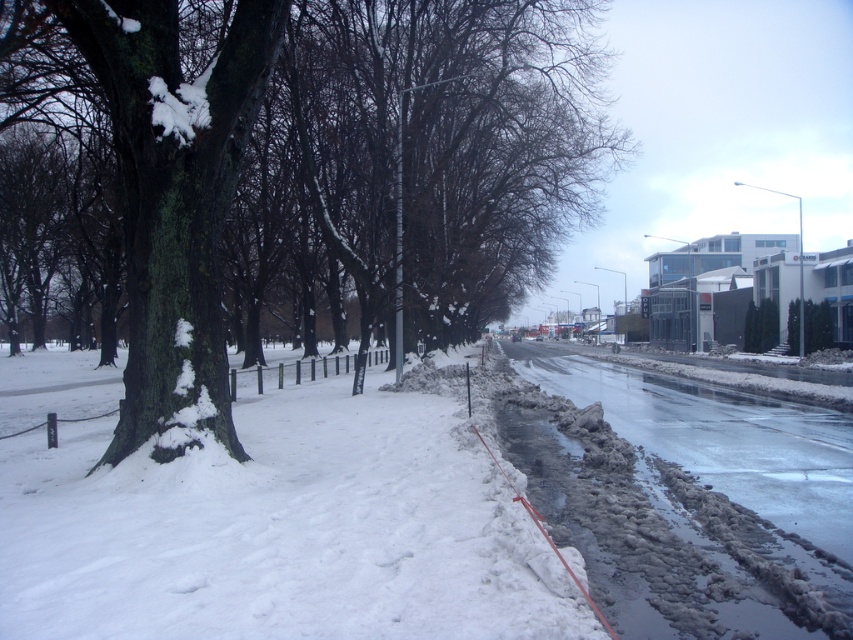
Is white fluffy snow at lower left taller than slick asphalt road at lower right?

Incorrect, white fluffy snow at lower left's height is not larger of slick asphalt road at lower right's.

Can you confirm if white fluffy snow at lower left is bigger than slick asphalt road at lower right?

Yes.

Is point (21, 628) in front of point (755, 422)?

Yes, it is in front of point (755, 422).

Identify the location of white fluffy snow at lower left. (280, 529).

Can you confirm if green mossy bark tree at left is positioned below slick asphalt road at lower right?

No.

Does point (451, 140) come closer to viewer compared to point (772, 460)?

No, it is behind (772, 460).

Does point (154, 323) come farther from viewer compared to point (834, 413)?

No, it is not.

The image size is (853, 640). Find the location of `green mossy bark tree at left`. green mossy bark tree at left is located at coordinates (323, 156).

In the scene shown: Between green mossy bark tree at left and white fluffy snow at lower left, which one is positioned higher?

Positioned higher is green mossy bark tree at left.

Does point (91, 32) come farther from viewer compared to point (486, 614)?

That is True.

Locate an element on the screen. The image size is (853, 640). green mossy bark tree at left is located at coordinates (323, 156).